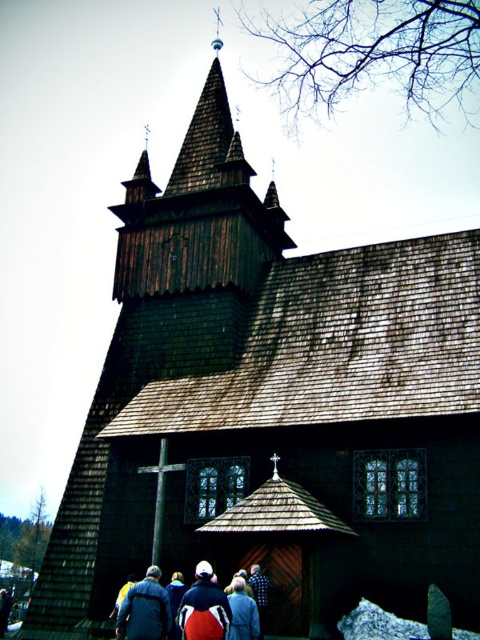
Based on the photo, you are standing at the entrance of the traditional wooden church and see a dark blue jacket at lower center and a red jacket at center. If you want to pick up both jackets, which one would you reach first if you move straight forward from the entrance?

The red jacket at center is closer to the entrance than the dark blue jacket at lower center, so you would reach the red jacket at center first.

You are a tailor who needs to determine which jacket to recommend for a customer who prefers a more fitted style. Based on the image, which jacket between the dark blue jacket at lower left and the blue fabric jacket at lower center would you suggest?

The dark blue jacket at lower left is thinner than the blue fabric jacket at lower center, so it would be more fitted and suitable for the customer who prefers a more fitted style.